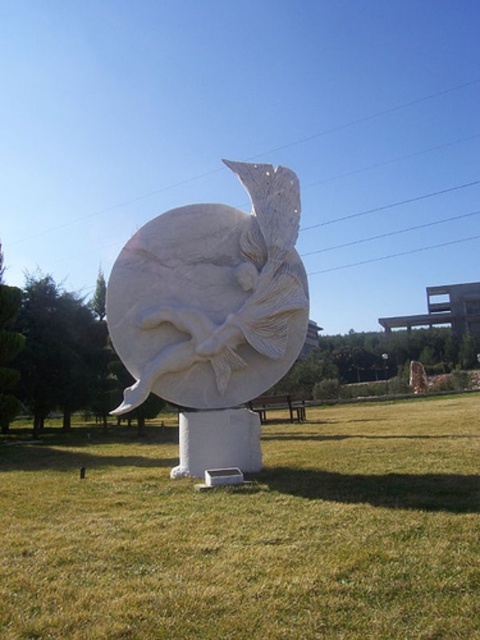
You are holding a camera and want to take a photo of the white marble sculpture at center. If you are standing 5.59 meters away from it, will you be able to capture the entire sculpture in your photo without moving closer or farther?

The white marble sculpture at center and camera are 5.59 meters apart from each other. Whether you can capture the entire sculpture depends on your camera lens and sensor size. However, since the distance is fixed, if your camera has a wide enough angle, it should be possible. But without specific lens information, we can only confirm the distance is 5.59 meters.

You are standing in a park and see the green grass at center and the brown wooden bench at center. Which one is higher up?

The green grass at center is located above the brown wooden bench at center, so the green grass at center is higher up.